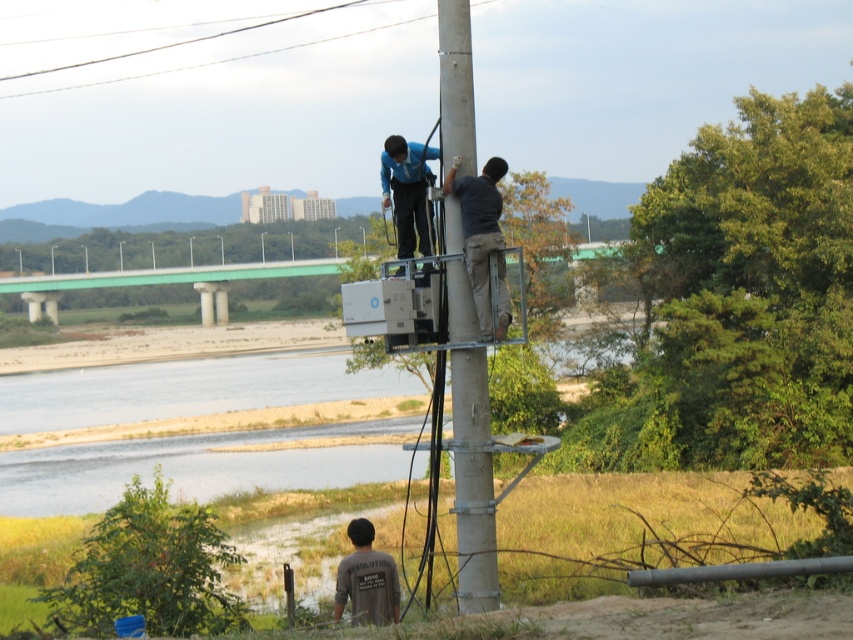
Which of these two, blue fabric construction worker at upper center or dark gray cotton shirt at lower center, stands taller?

blue fabric construction worker at upper center is taller.

Between point (416, 157) and point (387, 589), which one is positioned behind?

Positioned behind is point (416, 157).

At what (x,y) coordinates should I click in order to perform the action: click on blue fabric construction worker at upper center. Please return your answer as a coordinate pair (x, y). The height and width of the screenshot is (640, 853). Looking at the image, I should click on (407, 192).

Is concrete pole at center to the left of dark gray fabric pants at center from the viewer's perspective?

Indeed, concrete pole at center is positioned on the left side of dark gray fabric pants at center.

Is point (462, 368) in front of point (474, 195)?

No, (462, 368) is further to viewer.

The height and width of the screenshot is (640, 853). I want to click on concrete pole at center, so click(x=473, y=483).

Is dark gray fabric pants at center further to the viewer compared to metallic wire at upper center?

No.

Between dark gray fabric pants at center and metallic wire at upper center, which one has more height?

metallic wire at upper center

Between point (508, 317) and point (128, 77), which one is positioned in front?

Positioned in front is point (508, 317).

Identify the location of dark gray fabric pants at center. (482, 240).